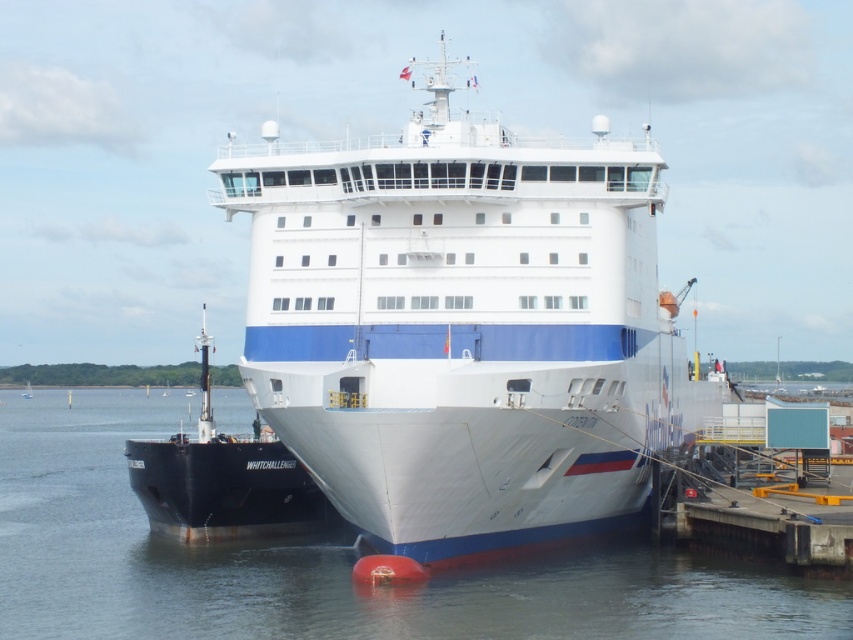
Between white glossy water at center and black matte ship at left, which one appears on the left side from the viewer's perspective?

Positioned to the left is white glossy water at center.

What do you see at coordinates (323, 563) in the screenshot? I see `white glossy water at center` at bounding box center [323, 563].

Is point (164, 557) positioned after point (144, 445)?

No.

The height and width of the screenshot is (640, 853). I want to click on white glossy water at center, so click(323, 563).